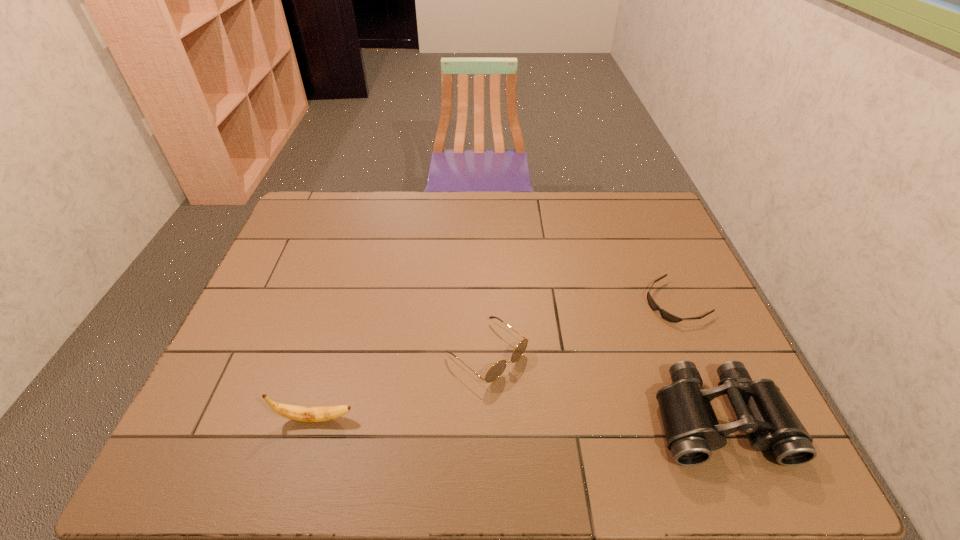
Image resolution: width=960 pixels, height=540 pixels. I want to click on banana, so click(298, 413).

Image resolution: width=960 pixels, height=540 pixels. I want to click on binoculars, so click(x=692, y=431).

Image resolution: width=960 pixels, height=540 pixels. What are the coordinates of `the left sunglasses` in the screenshot? It's located at (497, 369).

I want to click on the taller sunglasses, so click(x=497, y=369).

This screenshot has width=960, height=540. In order to click on the right sunglasses in this screenshot , I will do `click(665, 315)`.

This screenshot has height=540, width=960. Identify the location of the shortest object. (665, 315).

I want to click on free space located 0.360m on the peel of the leftmost object from the top, so click(x=516, y=418).

I want to click on free space located on the lenses of the second object from left to right, so 534,390.

Image resolution: width=960 pixels, height=540 pixels. In order to click on vacant space located on the lenses of the second object from left to right in this screenshot , I will do `click(537, 393)`.

Identify the location of blank space located 0.160m on the lenses of the second object from left to right. This screenshot has height=540, width=960. (571, 420).